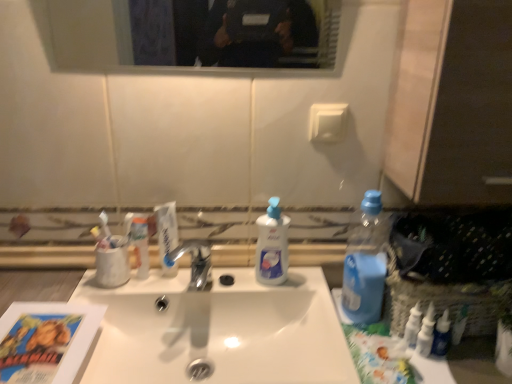
Locate an element on the screen. The height and width of the screenshot is (384, 512). free location to the left of white glossy liquid soap at center is located at coordinates (223, 285).